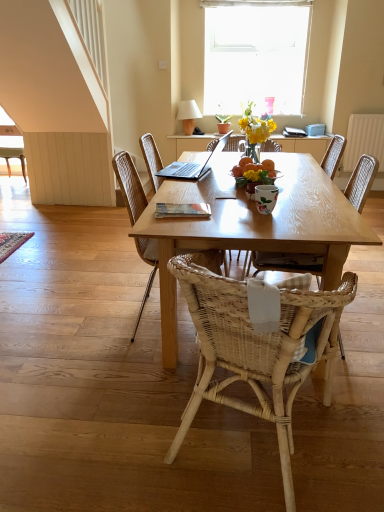
Locate an element on the screen. The height and width of the screenshot is (512, 384). empty space that is ontop of wooden book at center (from a real-world perspective) is located at coordinates (182, 202).